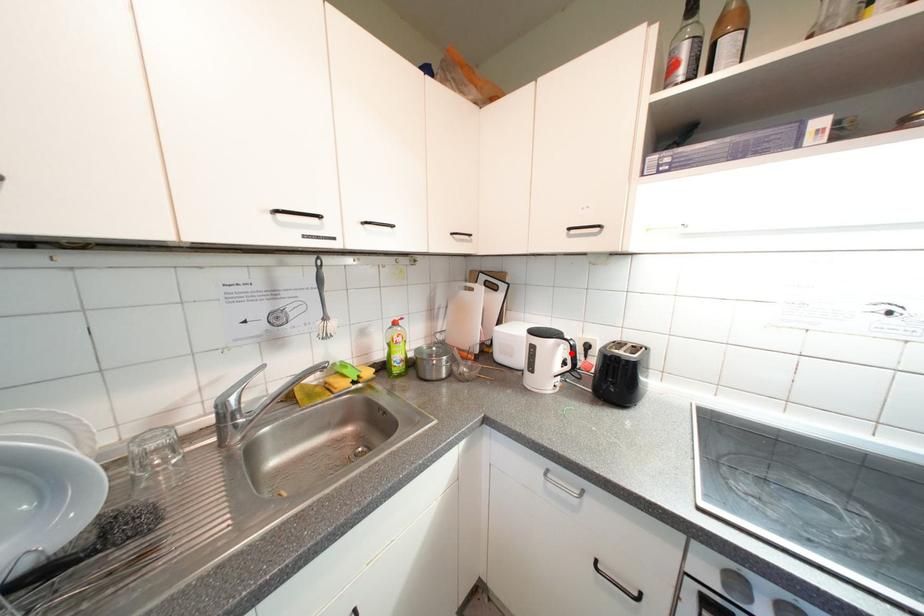
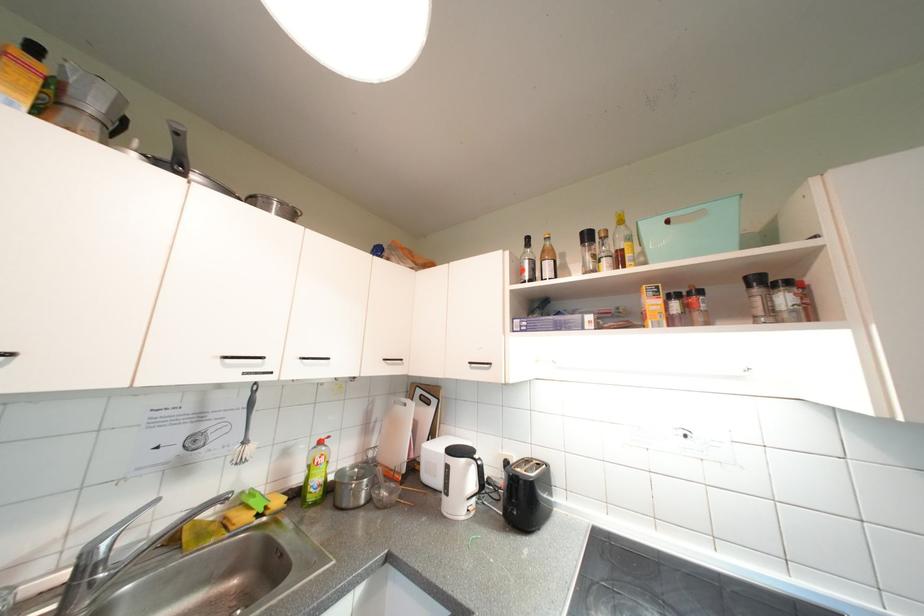
Find the pixel in the second image that matches the highlighted location in the first image.

(481, 474)